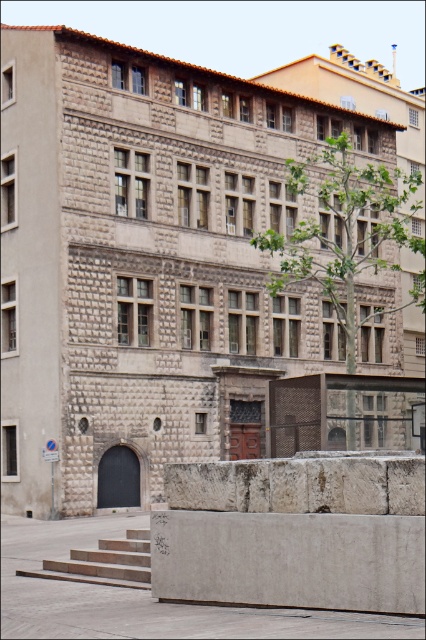
Question: Which point is closer to the camera?

Choices:
 (A) (325, 182)
 (B) (66, 563)

Answer: (B)

Question: Among these points, which one is nearest to the camera?

Choices:
 (A) (132, 536)
 (B) (276, 243)

Answer: (A)

Question: Is green leafy tree at center behind concrete steps at lower left?

Choices:
 (A) no
 (B) yes

Answer: (B)

Question: Does green leafy tree at center have a smaller size compared to concrete steps at lower left?

Choices:
 (A) yes
 (B) no

Answer: (B)

Question: Does green leafy tree at center lie behind concrete steps at lower left?

Choices:
 (A) yes
 (B) no

Answer: (A)